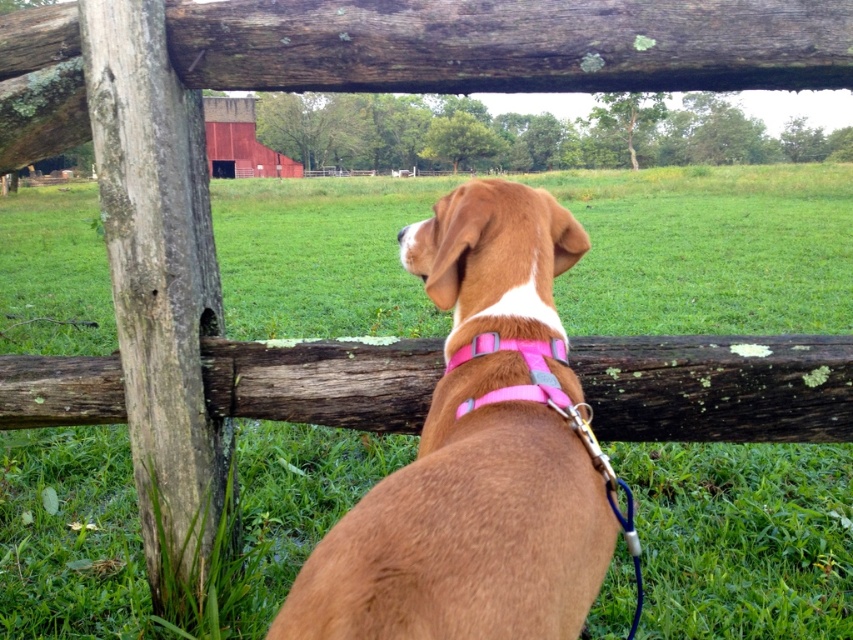
Question: Which object is farther from the camera taking this photo?

Choices:
 (A) brown matte dog at center
 (B) pink fabric neckband at center

Answer: (B)

Question: Is weathered wood log at center further to camera compared to pink fabric neckband at center?

Choices:
 (A) no
 (B) yes

Answer: (B)

Question: Which object appears closest to the camera in this image?

Choices:
 (A) weathered wood log at center
 (B) brown matte dog at center
 (C) pink fabric neckband at center

Answer: (B)

Question: Is brown matte dog at center above pink fabric neckband at center?

Choices:
 (A) yes
 (B) no

Answer: (B)

Question: Which of the following is the farthest from the observer?

Choices:
 (A) pink fabric neckband at center
 (B) weathered wood log at center
 (C) brown matte dog at center

Answer: (B)

Question: Can you confirm if brown matte dog at center is positioned to the left of pink fabric neckband at center?

Choices:
 (A) no
 (B) yes

Answer: (B)